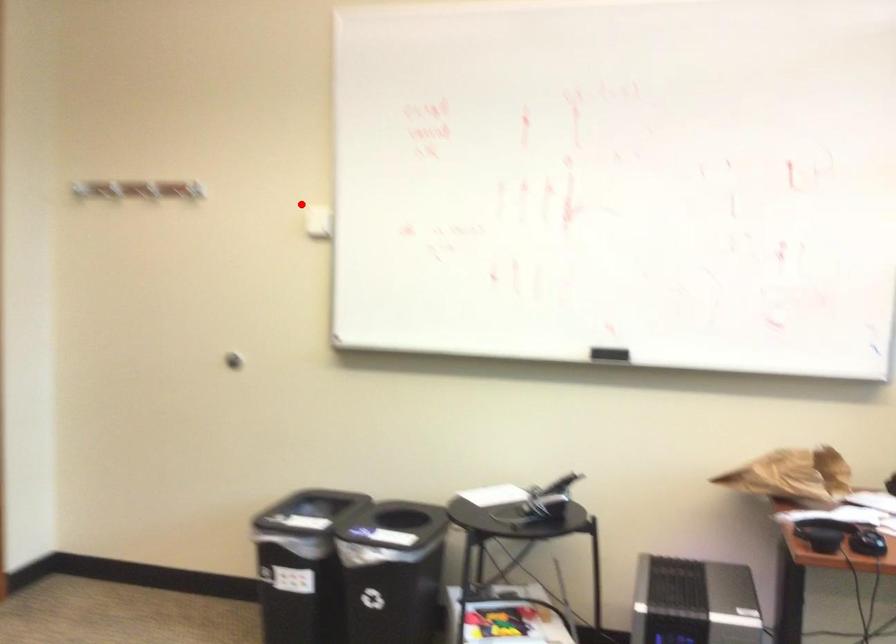
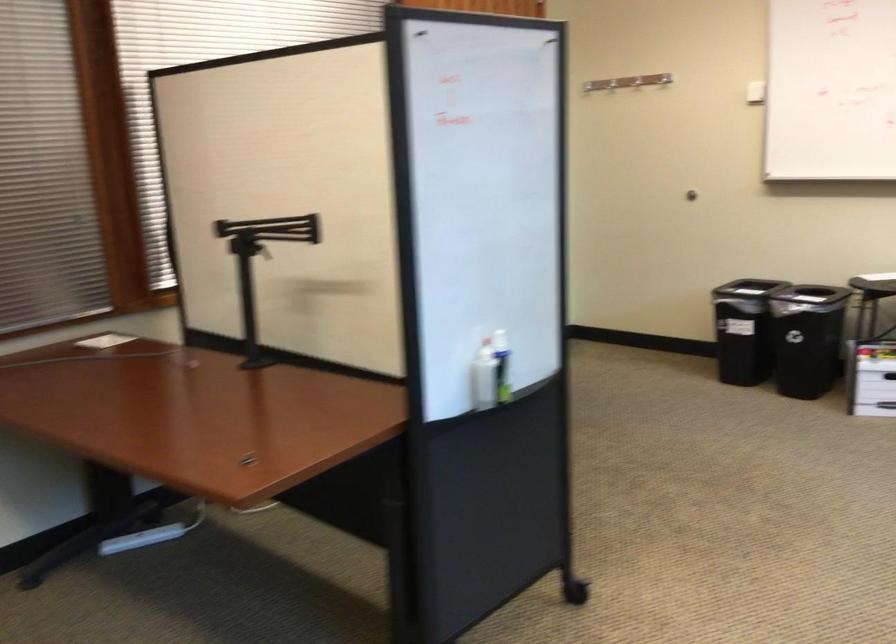
Find the pixel in the second image that matches the highlighted location in the first image.

(664, 79)